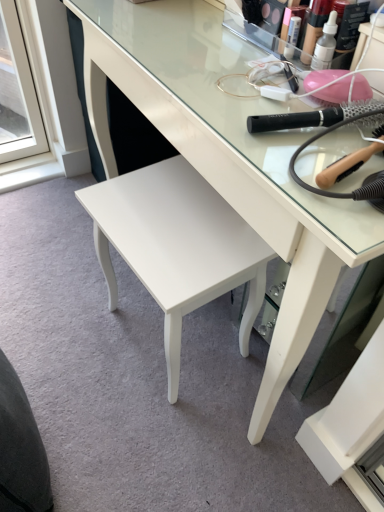
This screenshot has height=512, width=384. What are the coordinates of `empty space that is ontop of white glossy desk at center (from a real-world perspective)` in the screenshot? It's located at (221, 61).